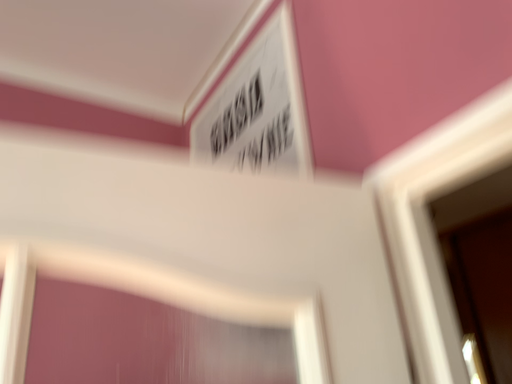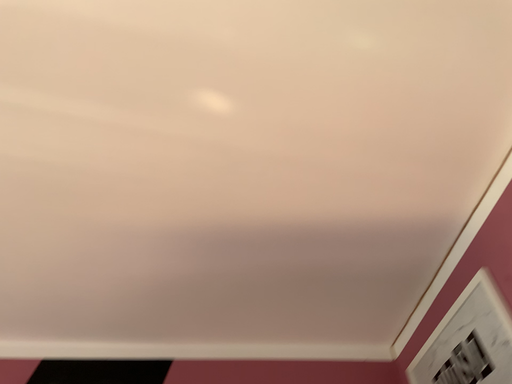
Question: Which way did the camera rotate in the video?

Choices:
 (A) rotated downward
 (B) rotated upward

Answer: (B)